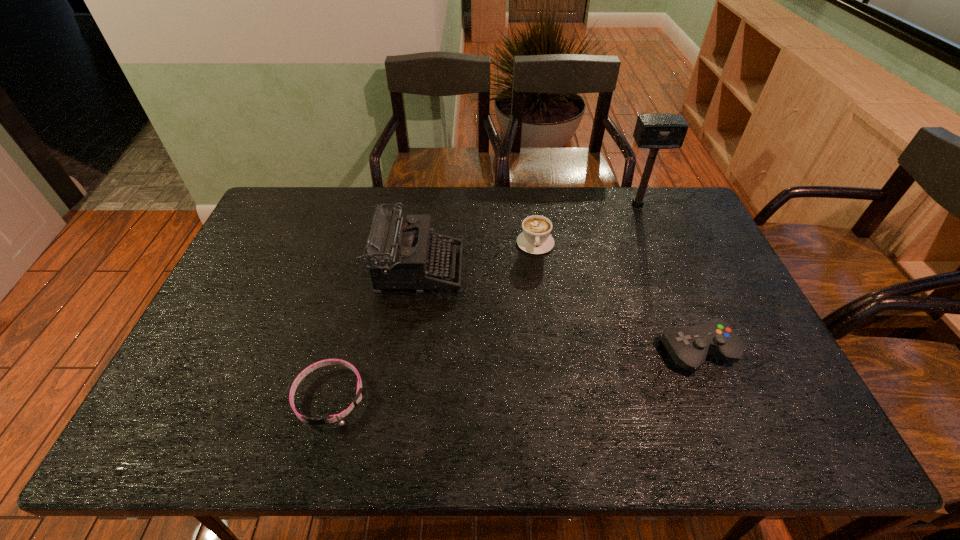
The height and width of the screenshot is (540, 960). I want to click on free point between the cappuccino and the shortest object, so click(433, 320).

At what (x,y) coordinates should I click in order to perform the action: click on free space between the control and the fourth shortest object. Please return your answer as a coordinate pair (x, y). This screenshot has height=540, width=960. Looking at the image, I should click on (558, 310).

Where is `vacant area between the shortest object and the control`? Image resolution: width=960 pixels, height=540 pixels. vacant area between the shortest object and the control is located at coordinates (514, 374).

Find the location of a particular element. free area in between the typewriter and the control is located at coordinates (558, 310).

Where is `vacant area that lies between the farthest object and the dog collar`? This screenshot has width=960, height=540. vacant area that lies between the farthest object and the dog collar is located at coordinates (484, 301).

At what (x,y) coordinates should I click in order to perform the action: click on free spot between the second tallest object and the cappuccino. Please return your answer as a coordinate pair (x, y). This screenshot has width=960, height=540. Looking at the image, I should click on (476, 256).

Identify the location of free space between the third object from left to right and the typewriter. (476, 256).

Find the location of `free spot between the control and the cappuccino`. free spot between the control and the cappuccino is located at coordinates (616, 298).

Locate an element on the screen. vacant area that lies between the typewriter and the control is located at coordinates (558, 310).

Locate an element on the screen. The width and height of the screenshot is (960, 540). object that is the closest to the typewriter is located at coordinates (535, 239).